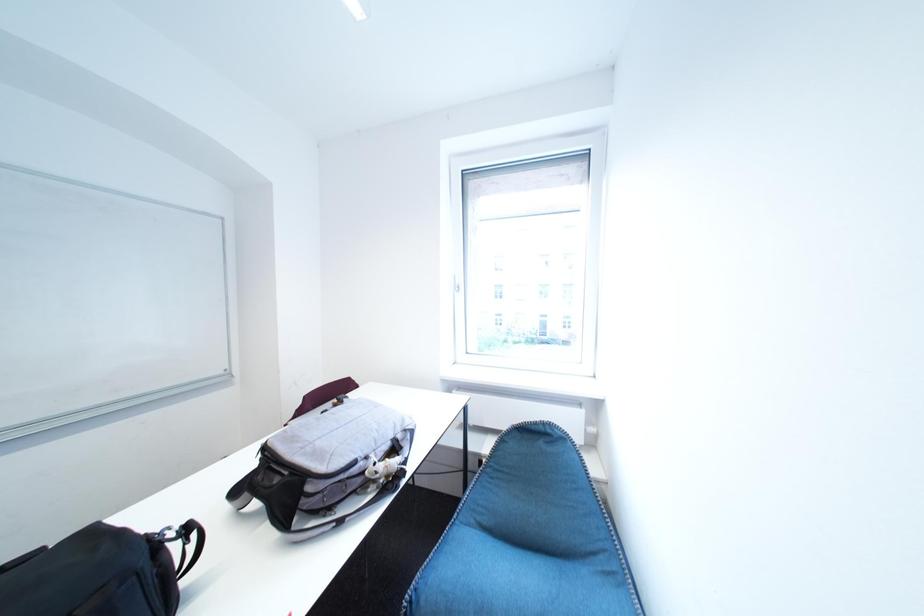
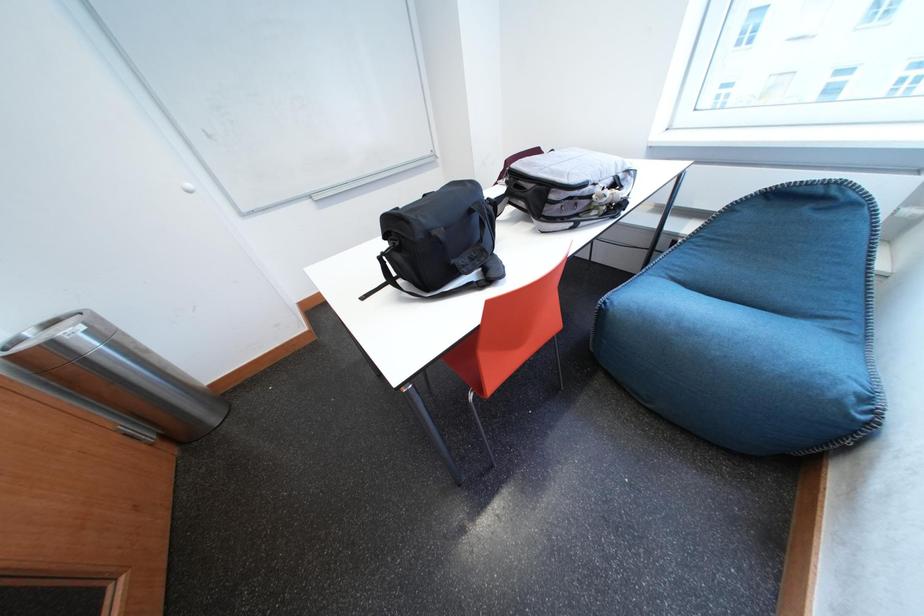
How did the camera likely rotate?

The camera's rotation is toward left-down.